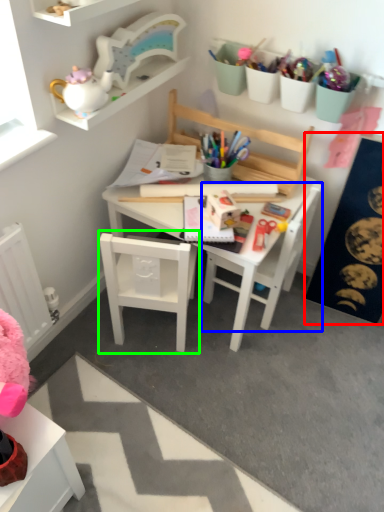
Question: Which object is the farthest from bulletin board (highlighted by a red box)? Choose among these: chair (highlighted by a blue box) or chair (highlighted by a green box).

Choices:
 (A) chair
 (B) chair

Answer: (B)